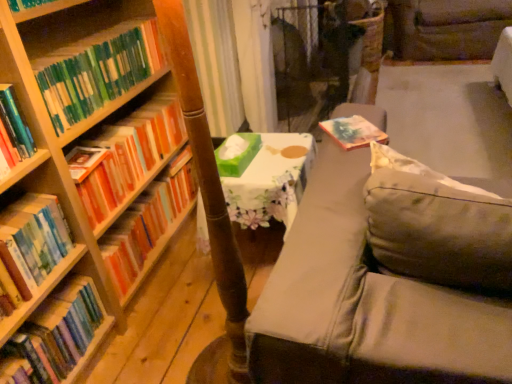
Question: Is point (484, 51) closer or farther from the camera than point (243, 147)?

Choices:
 (A) farther
 (B) closer

Answer: (A)

Question: Is gray fabric swivel chair at upper right in front of or behind green matte tissue box at center in the image?

Choices:
 (A) front
 (B) behind

Answer: (B)

Question: Which of these objects is positioned closest to the wooden bookcase at left?

Choices:
 (A) green matte tissue box at center
 (B) gray fabric couch at right
 (C) hardcover books at left, the 1th book when ordered from bottom to top
 (D) hardcover book at left, the 2th book ordered from the bottom
 (E) green matte bookshelf at left, marked as the fifth book in a bottom-to-top arrangement

Answer: (E)

Question: Based on their relative distances, which object is nearer to the gray fabric couch at right?

Choices:
 (A) gray fabric swivel chair at upper right
 (B) hardcover books at left, which appears as the second book when viewed from the top
 (C) orange matte bookshelf at left, which appears as the third book when ordered from the bottom
 (D) wooden bookcase at left
 (E) hardcover book at left, which ranks as the 4th book in top-to-bottom order

Answer: (E)